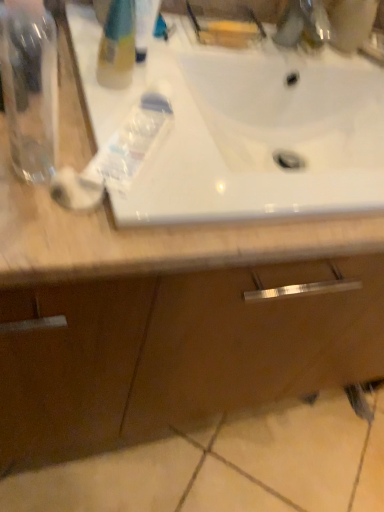
This screenshot has width=384, height=512. Find the location of `free space in front of translucent plastic bottle at upper left`. free space in front of translucent plastic bottle at upper left is located at coordinates click(81, 169).